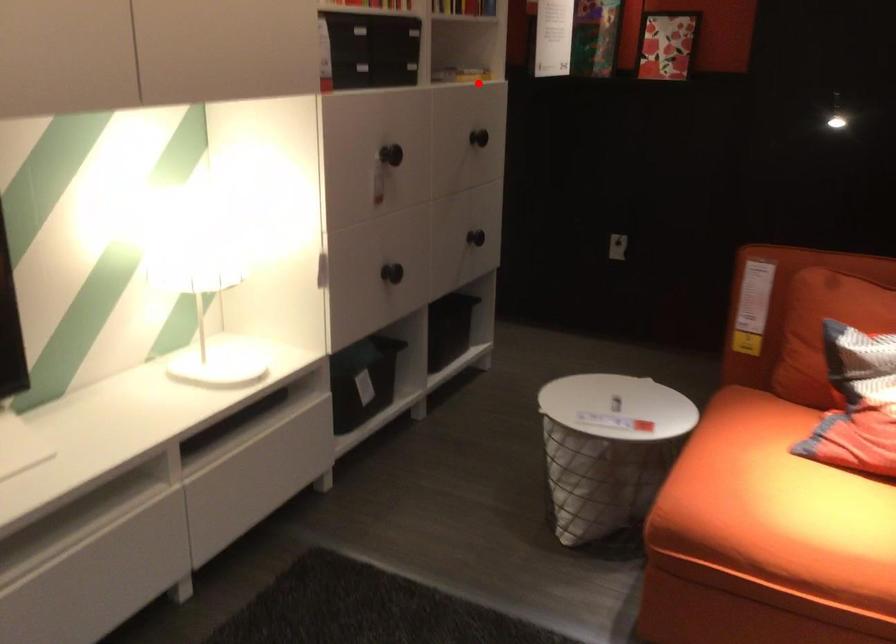
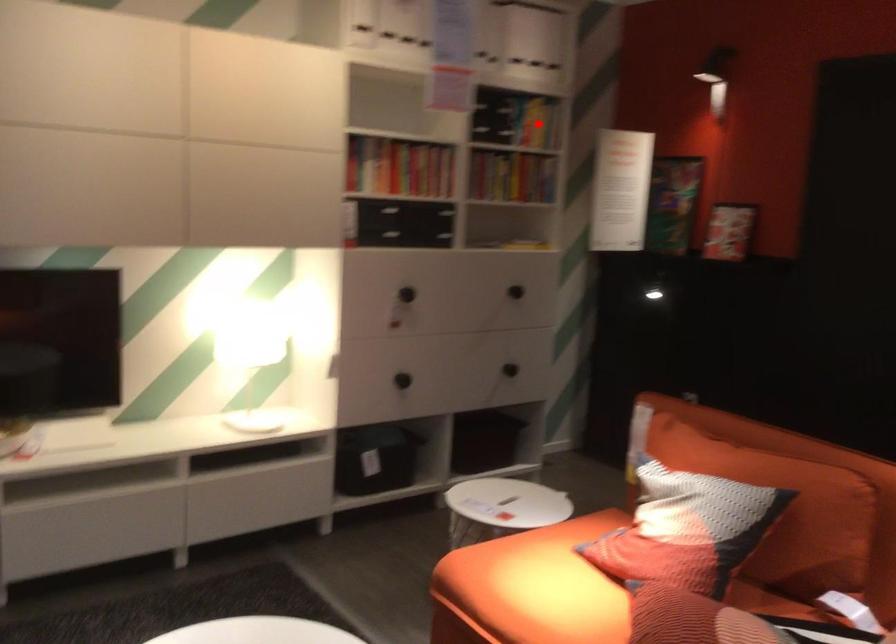
I am providing you with two images of the same scene from different viewpoints. A red point is marked on the first image and another point is marked on the second image. Does the point marked in image1 correspond to the same location as the one in image2?

No